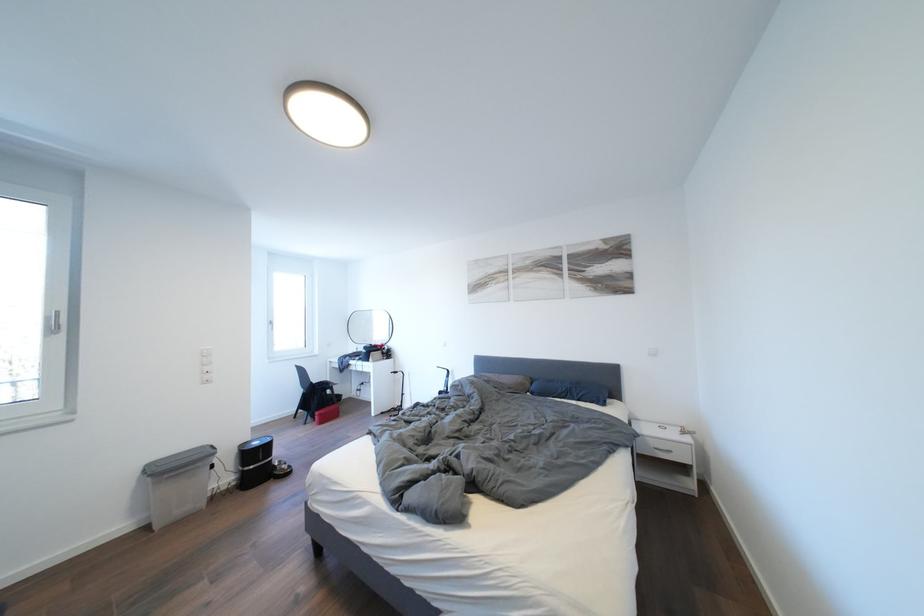
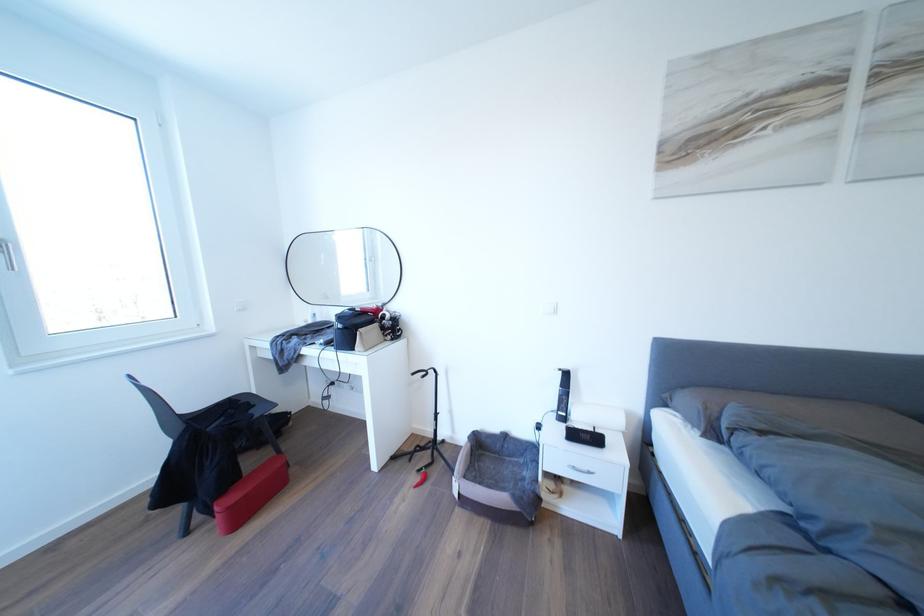
The point at (x=322, y=422) is marked in the first image. Where is the corresponding point in the second image?

(217, 519)